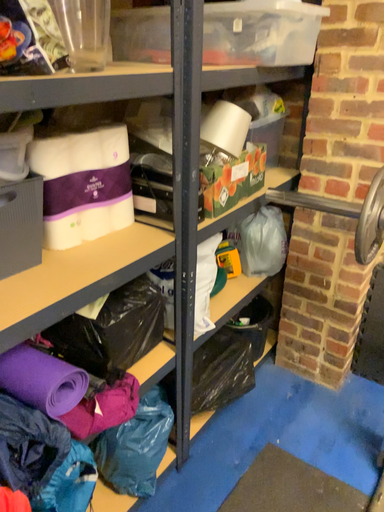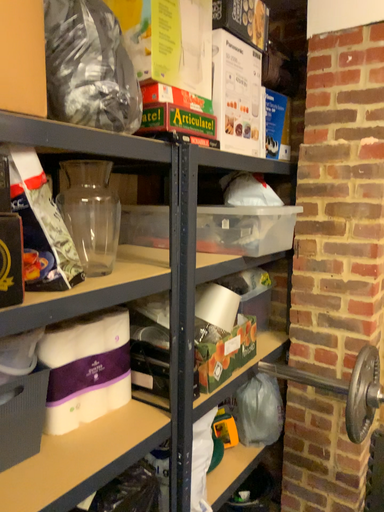
Question: How did the camera likely rotate when shooting the video?

Choices:
 (A) rotated upward
 (B) rotated downward

Answer: (A)